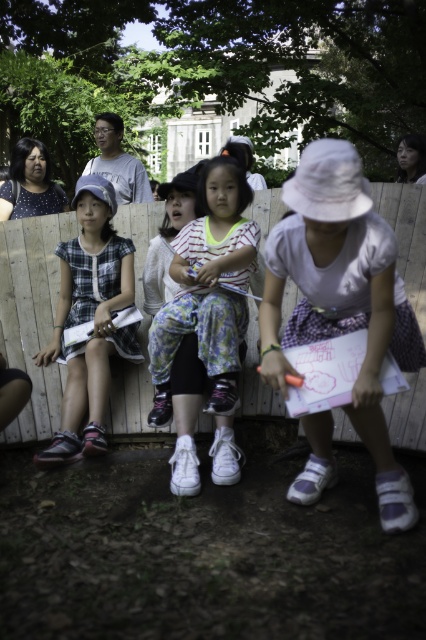
Between white matte sneakers at center and plaid fabric dress at center, which one has less height?

white matte sneakers at center is shorter.

Is white matte sneakers at center below plaid fabric dress at center?

Correct, white matte sneakers at center is located below plaid fabric dress at center.

Between point (244, 260) and point (74, 317), which one is positioned behind?

Point (74, 317)

Where is `white matte sneakers at center`? This screenshot has width=426, height=640. white matte sneakers at center is located at coordinates (206, 324).

Is wooden fence at center above plaid fabric dress at center?

Actually, wooden fence at center is below plaid fabric dress at center.

Between wooden fence at center and plaid fabric dress at center, which one appears on the right side from the viewer's perspective?

From the viewer's perspective, plaid fabric dress at center appears more on the right side.

The width and height of the screenshot is (426, 640). I want to click on wooden fence at center, so click(x=31, y=316).

Who is more forward, (319, 412) or (247, 358)?

Positioned in front is point (319, 412).

The width and height of the screenshot is (426, 640). I want to click on white cotton bucket hat at center, so click(x=342, y=298).